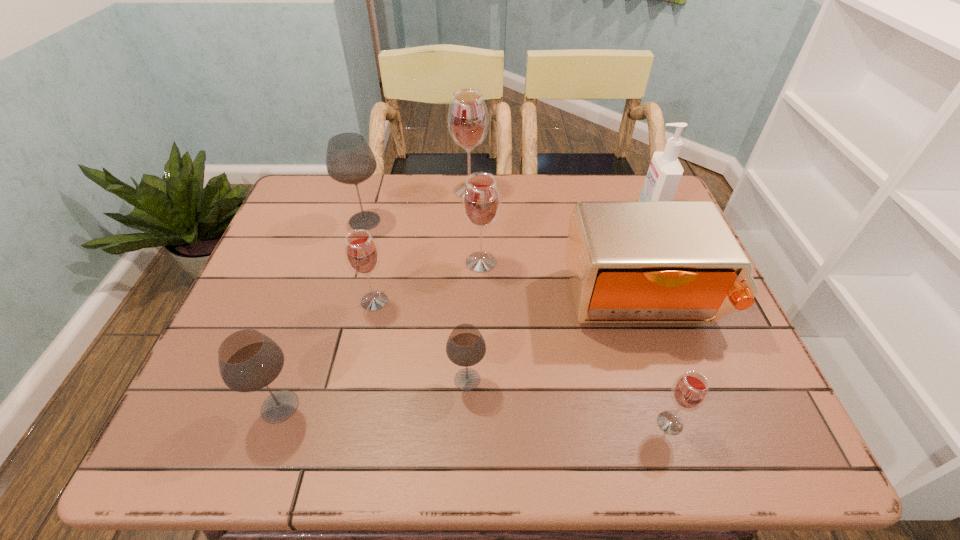
Locate an element on the screen. Image resolution: width=960 pixels, height=540 pixels. free space located on the door side of the white toaster oven is located at coordinates (696, 457).

This screenshot has width=960, height=540. I want to click on vacant space situated 0.230m on the left of the second nearest red wineglass, so click(263, 301).

Locate an element on the screen. The image size is (960, 540). vacant space located on the right of the second smallest gray wineglass is located at coordinates (432, 407).

The width and height of the screenshot is (960, 540). Identify the location of vacant position located 0.080m on the back of the smallest gray wineglass. (468, 334).

Locate an element on the screen. This screenshot has height=540, width=960. free space located on the back of the rightmost wineglass is located at coordinates (635, 311).

I want to click on cleansing agent that is at the far edge, so click(x=665, y=171).

Locate an element on the screen. The width and height of the screenshot is (960, 540). object positioned at the left edge is located at coordinates (248, 360).

Find the location of a particular element. cleansing agent present at the right edge is located at coordinates (665, 171).

The image size is (960, 540). Find the location of `toaster oven positioned at the right edge`. toaster oven positioned at the right edge is located at coordinates (628, 261).

You are a GUI agent. You are given a task and a screenshot of the screen. Output one action in this format:
    pyautogui.click(x=<x>, y=<y>)
    Task: Click on the object that is at the near left corner
    The height and width of the screenshot is (540, 960).
    Given the screenshot: What is the action you would take?
    pyautogui.click(x=248, y=360)